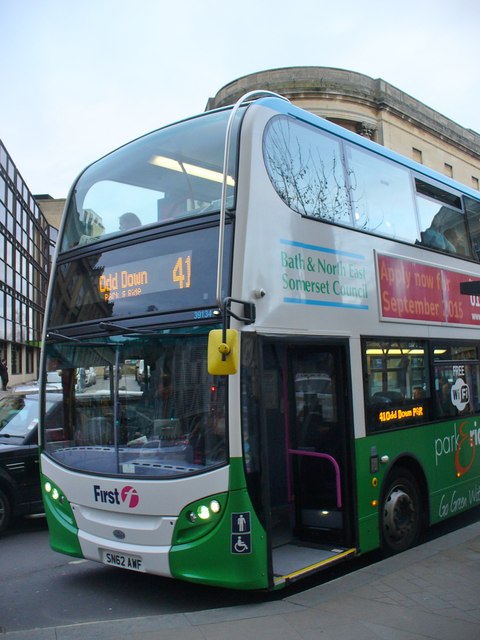
This screenshot has width=480, height=640. In order to click on digital screen in this screenshot , I will do `click(161, 273)`.